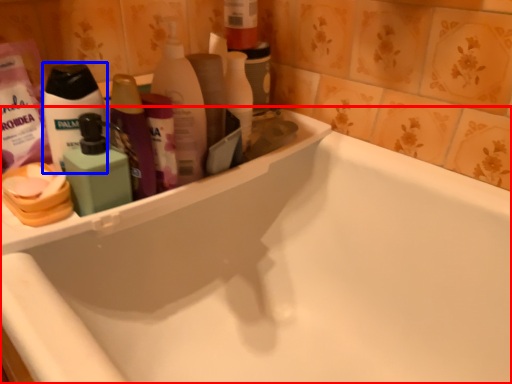
Question: Which object is closer to the camera taking this photo, bathtub (highlighted by a red box) or toiletry (highlighted by a blue box)?

Choices:
 (A) bathtub
 (B) toiletry

Answer: (A)